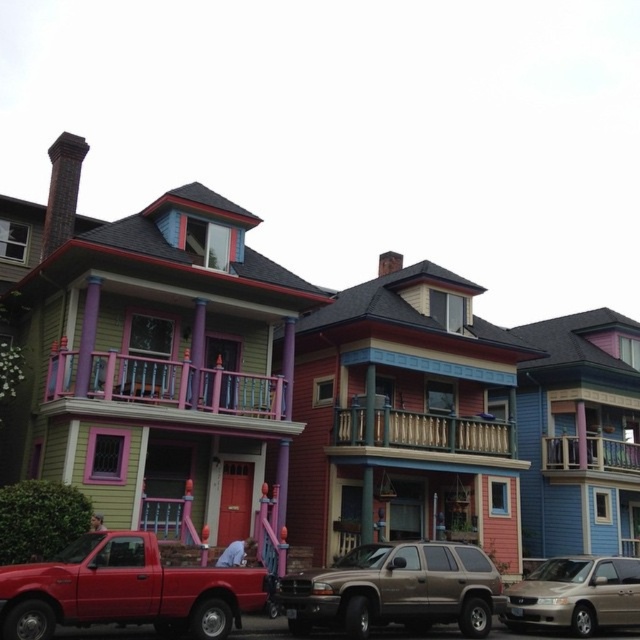
Question: Can you confirm if metallic red pickup truck at lower left is positioned to the right of gold metallic minivan at lower right?

Choices:
 (A) yes
 (B) no

Answer: (B)

Question: Observing the image, what is the correct spatial positioning of metallic red pickup truck at lower left in reference to gold metallic minivan at lower right?

Choices:
 (A) left
 (B) right

Answer: (A)

Question: Which object appears farthest from the camera in this image?

Choices:
 (A) pink painted wood at center
 (B) wooden railing at upper center

Answer: (B)

Question: Among these points, which one is nearest to the camera?

Choices:
 (A) (384, 408)
 (B) (632, 476)
 (C) (362, 572)

Answer: (C)

Question: Which point is closer to the camera taking this photo?

Choices:
 (A) (369, 602)
 (B) (84, 401)
 (C) (573, 627)

Answer: (A)

Question: Considering the relative positions of pink painted wood at center and wooden at center in the image provided, where is pink painted wood at center located with respect to wooden at center?

Choices:
 (A) left
 (B) right

Answer: (A)